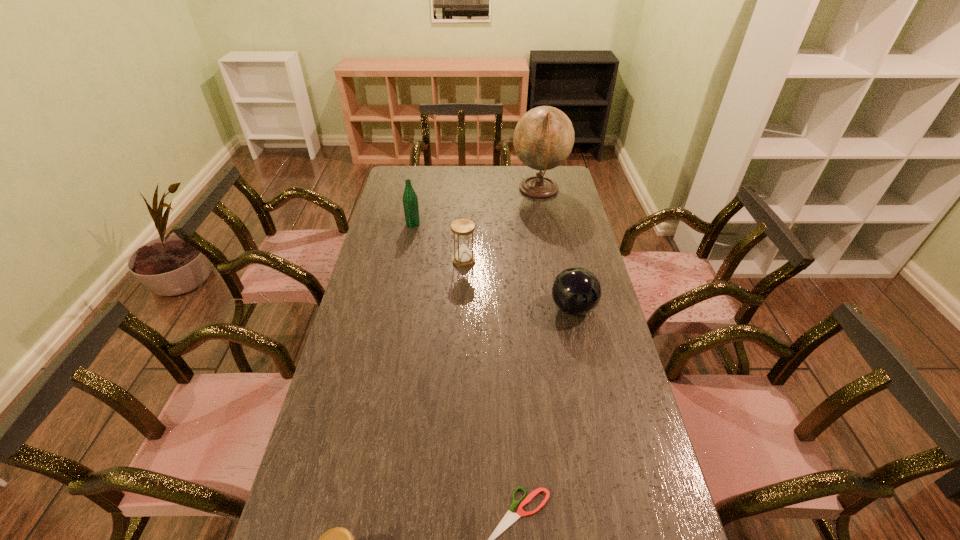
Where is `vacant space at the far edge of the desktop`? The image size is (960, 540). vacant space at the far edge of the desktop is located at coordinates (468, 179).

I want to click on free space at the left edge of the desktop, so click(348, 366).

Image resolution: width=960 pixels, height=540 pixels. Identify the location of vacant space at the right edge of the desktop. (595, 314).

At what (x,y) coordinates should I click in order to perform the action: click on unoccupied position between the globe and the third nearest object. Please return your answer as a coordinate pair (x, y). Looking at the image, I should click on (556, 249).

Find the location of `empty space that is in between the fifth shortest object and the bowling ball`. empty space that is in between the fifth shortest object and the bowling ball is located at coordinates (493, 266).

You are a GUI agent. You are given a task and a screenshot of the screen. Output one action in this format:
    pyautogui.click(x=<x>, y=<y>)
    Task: Click on the vacant space that is in between the fourth nearest object and the globe
    This screenshot has width=960, height=540.
    Given the screenshot: What is the action you would take?
    pyautogui.click(x=501, y=225)

Image resolution: width=960 pixels, height=540 pixels. What are the coordinates of `free space between the bowling ball and the fifth nearest object` in the screenshot? It's located at (493, 266).

You are a GUI agent. You are given a task and a screenshot of the screen. Output one action in this format:
    pyautogui.click(x=<x>, y=<y>)
    Task: Click on the object identified as the third closest to the farthest object
    The image size is (960, 540).
    Given the screenshot: What is the action you would take?
    pyautogui.click(x=576, y=291)

Select which object is the second closest to the bottle. Please provide its 2D coordinates. Your answer should be formatted as a tuple, i.e. [(x, y)], where the tuple contains the x and y coordinates of a point satisfying the conditions above.

[(543, 138)]